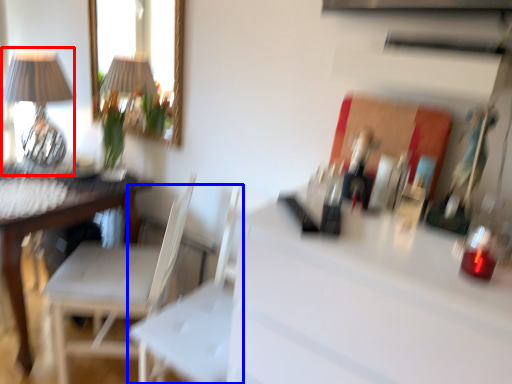
Question: Among these objects, which one is nearest to the camera, table lamp (highlighted by a red box) or swivel chair (highlighted by a blue box)?

Choices:
 (A) table lamp
 (B) swivel chair

Answer: (B)